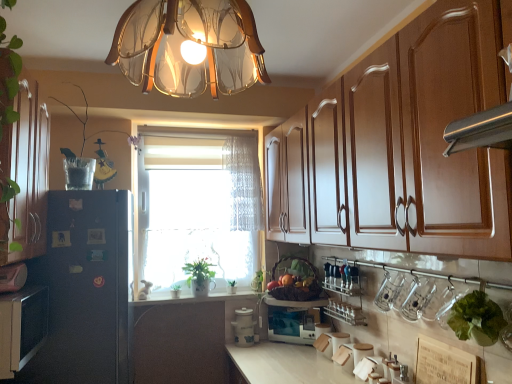
Question: From a real-world perspective, is white ceramic container at center, the second appliance in the right-to-left sequence, positioned above or below green leafy plant at window, which is counted as the 2th plant, starting from the bottom?

Choices:
 (A) below
 (B) above

Answer: (A)

Question: Considering the positions of white ceramic container at center, which is counted as the 1th appliance, starting from the left, and green leafy plant at window, arranged as the 3th plant when viewed from the left, in the image, is white ceramic container at center, which is counted as the 1th appliance, starting from the left, wider or thinner than green leafy plant at window, arranged as the 3th plant when viewed from the left,?

Choices:
 (A) wide
 (B) thin

Answer: (A)

Question: Which object is positioned closest to the green leafy lettuce at lower right, the 1th plant when ordered from right to left?

Choices:
 (A) green matte plant at center
 (B) metallic silver spice rack at lower center
 (C) matte black microwave at center, the second appliance in the left-to-right sequence
 (D) green leafy plant at window, acting as the first plant starting from the bottom
 (E) translucent glass chandelier at upper center

Answer: (B)

Question: Which of these objects is positioned farthest from the matte black microwave at center, the second appliance in the left-to-right sequence?

Choices:
 (A) matte white cabinet at left, acting as the 3th cabinetry starting from the right
 (B) black matte refrigerator at left
 (C) green leafy plant at window, which is counted as the 2th plant, starting from the bottom
 (D) translucent glass vase at left, the second plant when ordered from front to back
 (E) white lace curtain at center

Answer: (A)